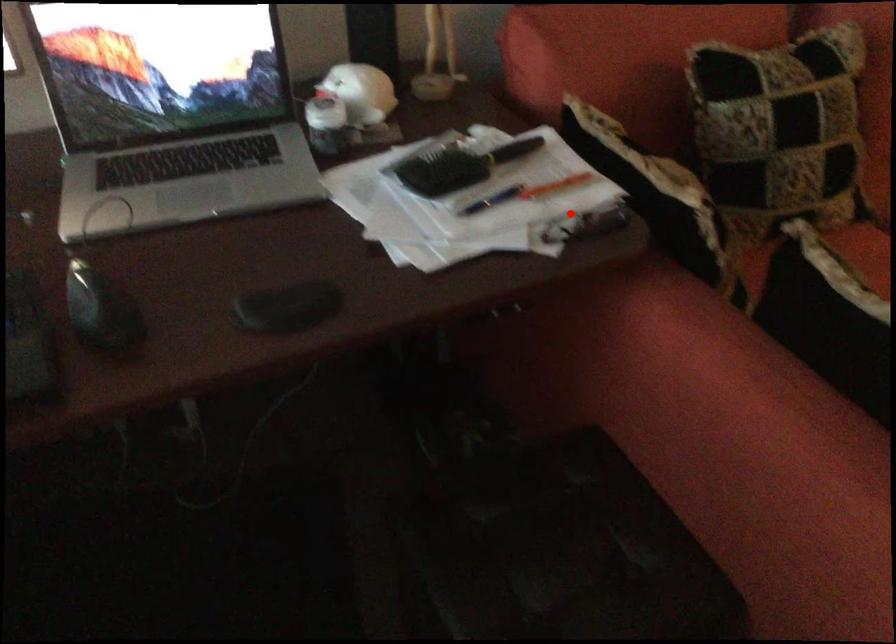
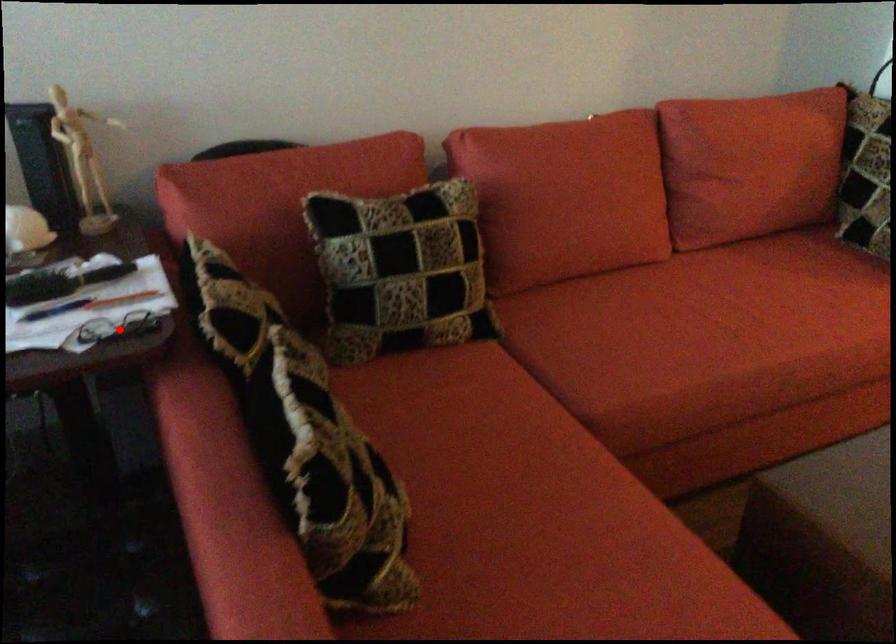
I am providing you with two images of the same scene from different viewpoints. A red point is marked on the first image and another point is marked on the second image. Does the point marked in image1 correspond to the same location as the one in image2?

Yes